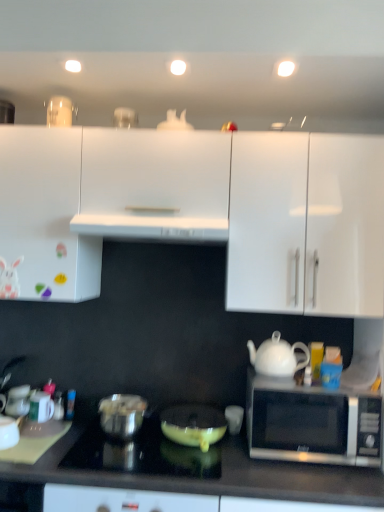
Question: Is white glossy mug at lower left aimed at white glossy teapot at right?

Choices:
 (A) yes
 (B) no

Answer: (B)

Question: Are white glossy mug at lower left and white glossy teapot at right located far from each other?

Choices:
 (A) yes
 (B) no

Answer: (A)

Question: Is white glossy mug at lower left at the right side of white glossy teapot at right?

Choices:
 (A) yes
 (B) no

Answer: (B)

Question: From the image's perspective, is white glossy mug at lower left over white glossy teapot at right?

Choices:
 (A) yes
 (B) no

Answer: (B)

Question: Could white glossy teapot at right be considered to be inside white glossy mug at lower left?

Choices:
 (A) yes
 (B) no

Answer: (B)

Question: Looking at the image, does shiny black cooktop at center seem bigger or smaller compared to shiny metallic pot at lower left, placed as the 2th appliance when sorted from right to left?

Choices:
 (A) small
 (B) big

Answer: (B)

Question: Considering the positions of point (193, 460) and point (140, 397), is point (193, 460) closer or farther from the camera than point (140, 397)?

Choices:
 (A) farther
 (B) closer

Answer: (B)

Question: From the image's perspective, is shiny black cooktop at center positioned above or below shiny metallic pot at lower left, which is counted as the second appliance, starting from the left?

Choices:
 (A) below
 (B) above

Answer: (A)

Question: Is shiny black cooktop at center spatially inside shiny metallic pot at lower left, which is counted as the second appliance, starting from the left, or outside of it?

Choices:
 (A) outside
 (B) inside

Answer: (A)

Question: From their relative heights in the image, would you say white glossy teapot at right is taller or shorter than white plastic exhaust hood at center?

Choices:
 (A) tall
 (B) short

Answer: (A)

Question: Is point (302, 365) positioned closer to the camera than point (198, 239)?

Choices:
 (A) closer
 (B) farther

Answer: (A)

Question: Is white glossy teapot at right situated inside white plastic exhaust hood at center or outside?

Choices:
 (A) outside
 (B) inside

Answer: (A)

Question: From the image's perspective, is white glossy teapot at right positioned above or below white plastic exhaust hood at center?

Choices:
 (A) above
 (B) below

Answer: (B)

Question: From a real-world perspective, is matte yellow frying pan at center, which is counted as the 3th appliance, starting from the left, physically located above or below shiny black cooktop at center?

Choices:
 (A) above
 (B) below

Answer: (A)

Question: Would you say matte yellow frying pan at center, the first appliance from the right, is to the left or to the right of shiny black cooktop at center in the picture?

Choices:
 (A) left
 (B) right

Answer: (B)